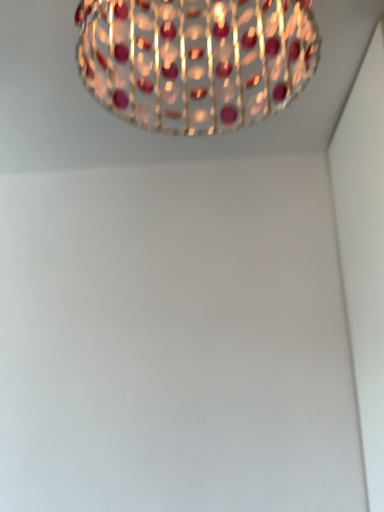
Where is `translucent glass sphere at upper center`? This screenshot has height=512, width=384. translucent glass sphere at upper center is located at coordinates (196, 60).

The width and height of the screenshot is (384, 512). What do you see at coordinates (196, 60) in the screenshot? I see `translucent glass sphere at upper center` at bounding box center [196, 60].

This screenshot has height=512, width=384. Identify the location of translucent glass sphere at upper center. (196, 60).